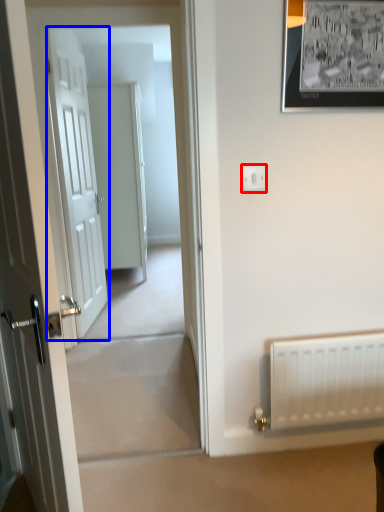
Question: Which point is further to the camera, electric outlet (highlighted by a red box) or door (highlighted by a blue box)?

Choices:
 (A) electric outlet
 (B) door

Answer: (B)